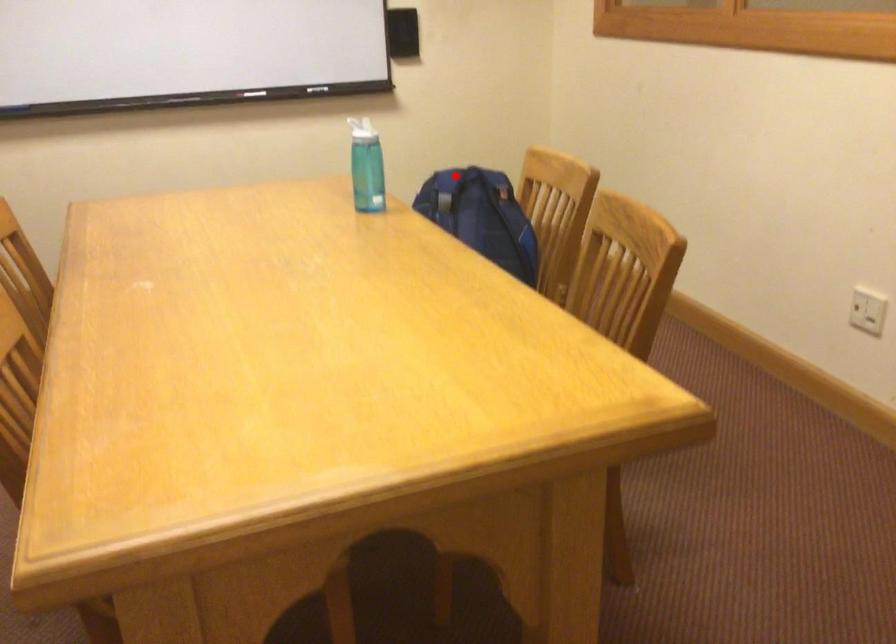
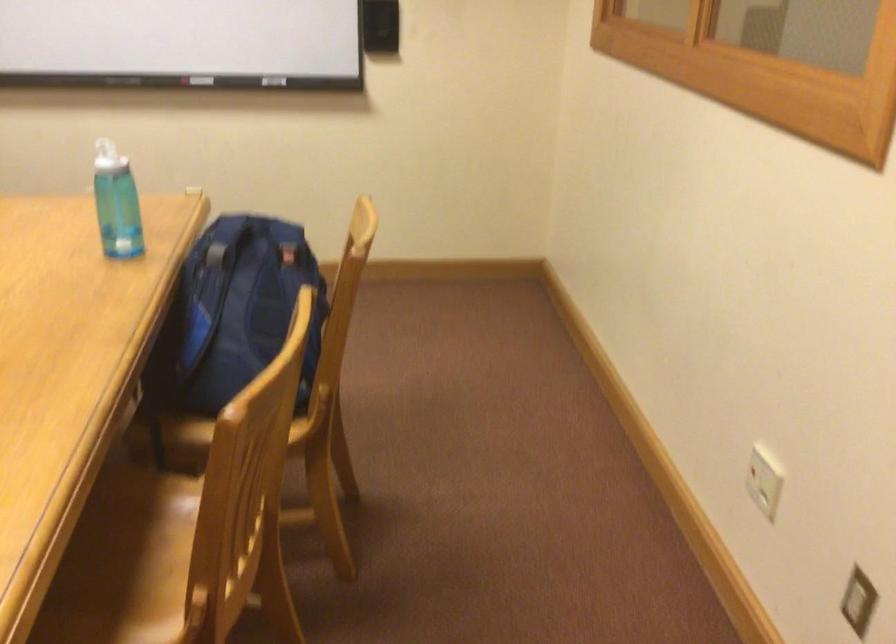
Question: A red point is marked in image1. In image2, is the corresponding 3D point closer to the camera or farther? Reply with the corresponding letter.

Choices:
 (A) The corresponding 3D point is closer.
 (B) The corresponding 3D point is farther.

Answer: (A)